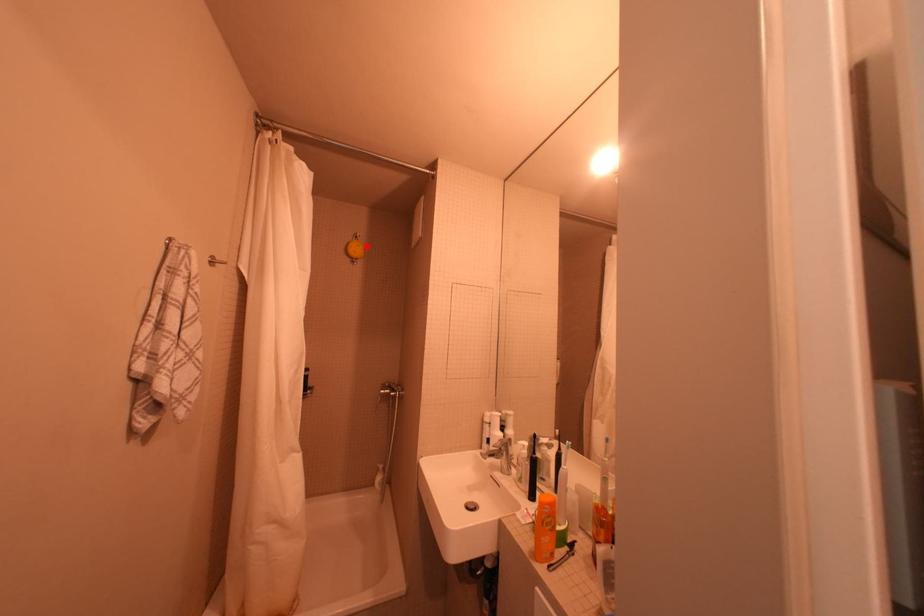
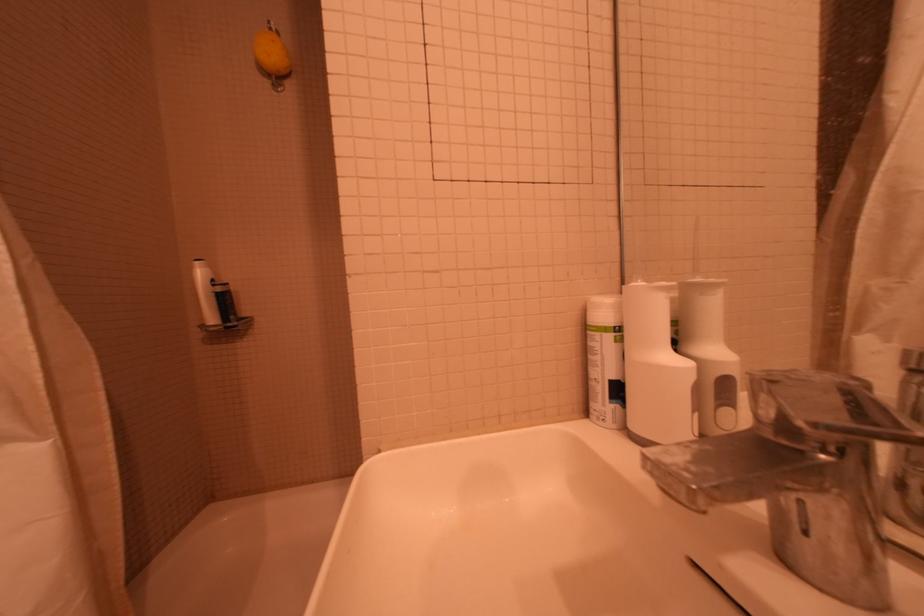
Question: A red point is marked in image1. In image2, is the corresponding 3D point closer to the camera or farther? Reply with the corresponding letter.

Choices:
 (A) The corresponding 3D point is closer.
 (B) The corresponding 3D point is farther.

Answer: (B)